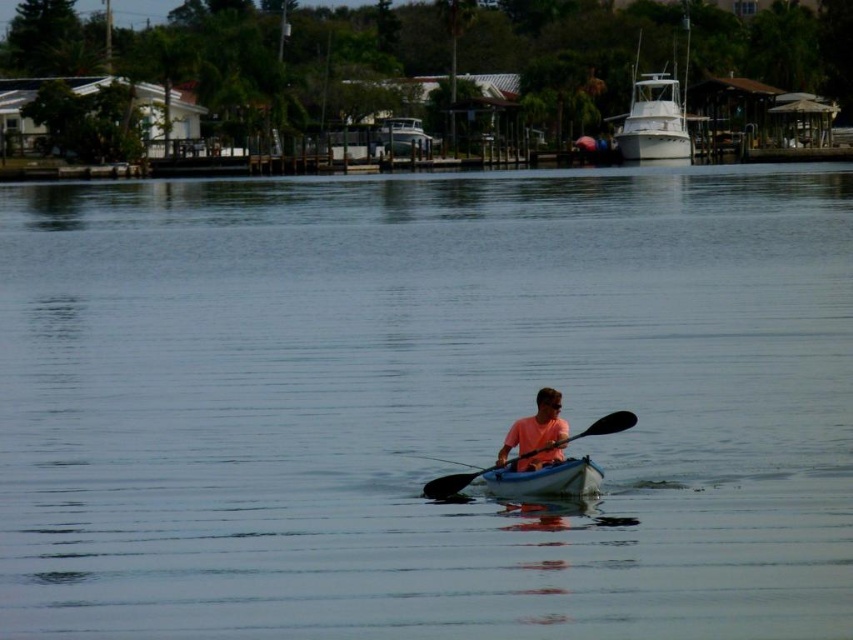
You are standing at the edge of the waterfront scene and want to walk towards the two points labeled as point (527, 474) and point (561, 428). Which point will you reach first?

You will reach point (527, 474) first because it is closer to you than point (561, 428), which is further away.

You are standing on the dock and see the pink matte kayak at center and the black rubber paddle at center. Which object is taller?

The pink matte kayak at center is much taller than the black rubber paddle at center.